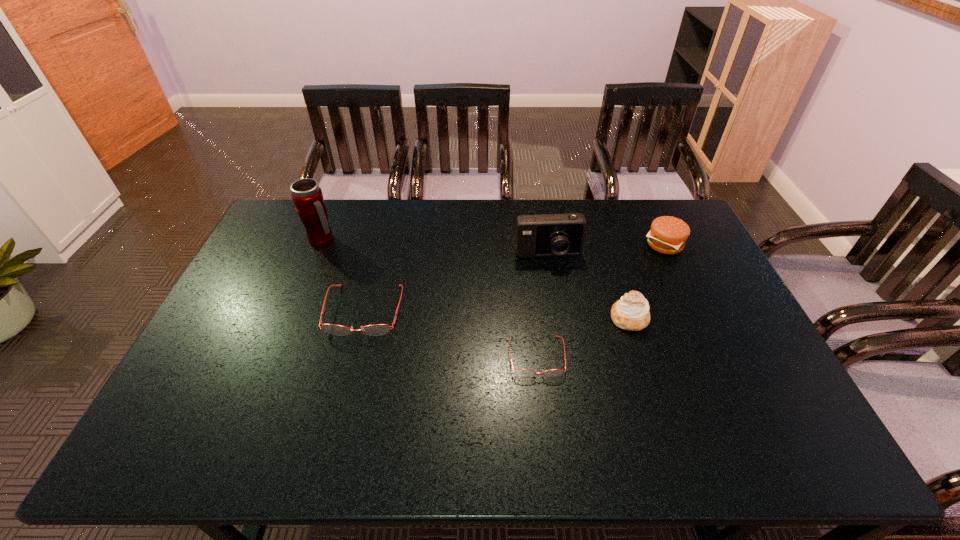
Identify the location of vacant space located 0.100m on the lenses of the shorter spectacles. The width and height of the screenshot is (960, 540). (543, 414).

This screenshot has width=960, height=540. I want to click on free region located on the front-facing side of the camera, so click(562, 335).

This screenshot has width=960, height=540. What are the coordinates of `vacant region located 0.080m on the side with the handle of the thermos bottle` in the screenshot? It's located at (x=361, y=240).

I want to click on vacant region located 0.330m on the front of the rightmost object, so click(708, 337).

At what (x,y) coordinates should I click in order to perform the action: click on free spot located on the right of the pastry. Please return your answer as a coordinate pair (x, y). The width and height of the screenshot is (960, 540). Looking at the image, I should click on (x=736, y=318).

This screenshot has height=540, width=960. Find the location of `thermos bottle at the far edge`. thermos bottle at the far edge is located at coordinates (307, 196).

You are a GUI agent. You are given a task and a screenshot of the screen. Output one action in this format:
    pyautogui.click(x=<x>, y=<y>)
    Task: Click on the hamburger present at the far edge
    
    Given the screenshot: What is the action you would take?
    pyautogui.click(x=668, y=235)

The width and height of the screenshot is (960, 540). I want to click on object positioned at the left edge, so click(x=307, y=196).

You are a GUI agent. You are given a task and a screenshot of the screen. Output one action in this format:
    pyautogui.click(x=<x>, y=<y>)
    Task: Click on the object situated at the right edge
    Image resolution: width=960 pixels, height=540 pixels.
    Given the screenshot: What is the action you would take?
    pyautogui.click(x=668, y=235)

You are a GUI agent. You are given a task and a screenshot of the screen. Output one action in this format:
    pyautogui.click(x=<x>, y=<y>)
    Task: Click on the object that is at the far left corner
    The height and width of the screenshot is (540, 960).
    Given the screenshot: What is the action you would take?
    pyautogui.click(x=307, y=196)